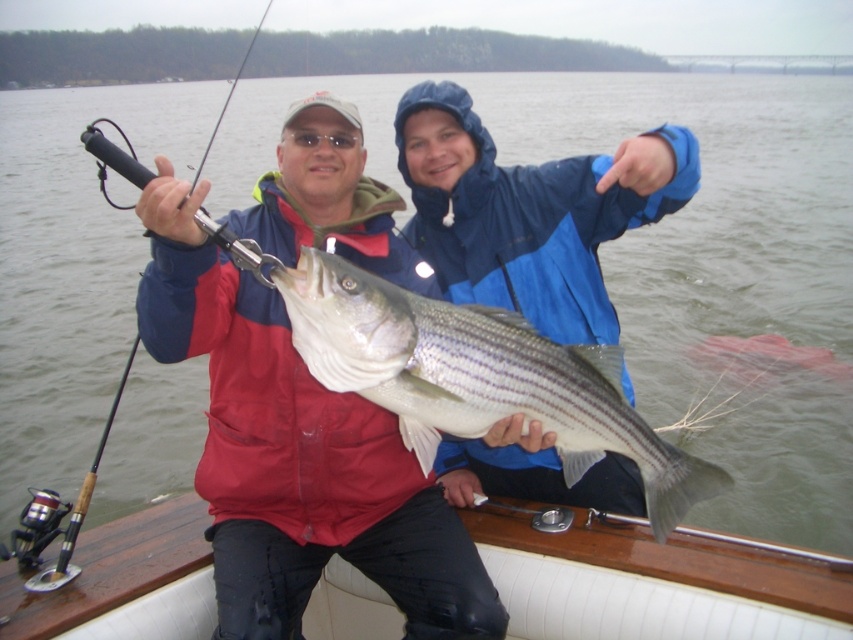
Between white wood boat at center and blue waterproof jacket at upper center, which one has less height?

With less height is white wood boat at center.

Who is higher up, white wood boat at center or blue waterproof jacket at upper center?

blue waterproof jacket at upper center is above.

Which is behind, point (589, 556) or point (442, 156)?

The point (442, 156) is behind.

Image resolution: width=853 pixels, height=640 pixels. I want to click on white wood boat at center, so click(653, 584).

Does point (91, 618) lie in front of point (245, 61)?

Yes.

Identify the location of white wood boat at center. (653, 584).

You are a GUI agent. You are given a task and a screenshot of the screen. Output one action in this format:
    pyautogui.click(x=<x>, y=<y>)
    Task: Click on the white wood boat at center
    This screenshot has height=640, width=853.
    Given the screenshot: What is the action you would take?
    pyautogui.click(x=653, y=584)

Based on the photo, who is positioned more to the left, white wood boat at center or white glossy fish at center?

white glossy fish at center is more to the left.

Between point (518, 516) and point (550, 412), which one is positioned behind?

The point (518, 516) is behind.

Image resolution: width=853 pixels, height=640 pixels. I want to click on white wood boat at center, so click(x=653, y=584).